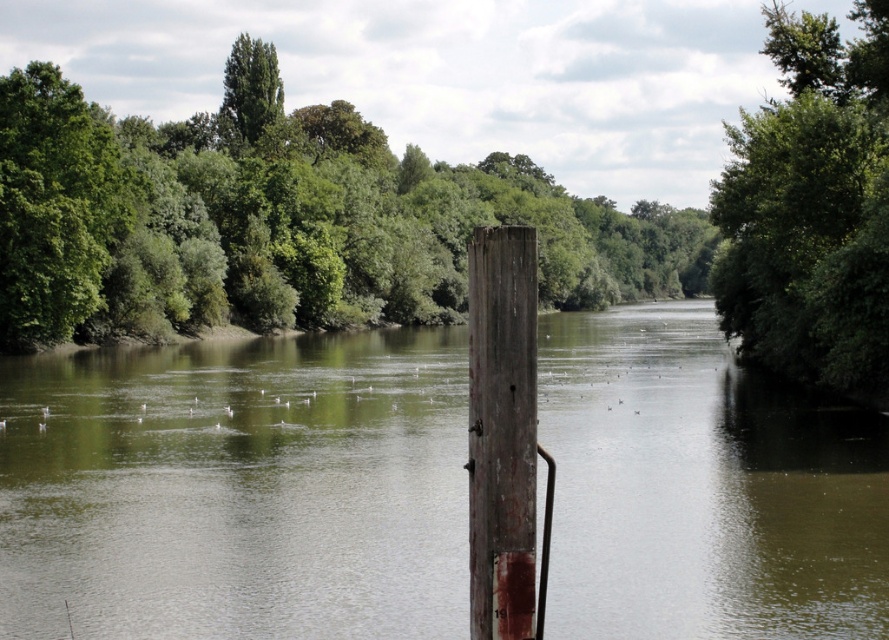
Is green leafy tree at upper right thinner than weathered wood post at center?

No.

Locate an element on the screen. The width and height of the screenshot is (889, 640). green leafy tree at upper right is located at coordinates (811, 209).

Who is more distant from viewer, [751,292] or [502,518]?

Positioned behind is point [751,292].

The image size is (889, 640). What are the coordinates of `green leafy tree at upper right` in the screenshot? It's located at (811, 209).

Does point (742, 570) come closer to viewer compared to point (859, 173)?

Yes, point (742, 570) is closer to viewer.

Consider the image. Is greenish-brown water at center smaller than green leafy tree at upper right?

Indeed, greenish-brown water at center has a smaller size compared to green leafy tree at upper right.

Which is behind, point (729, 518) or point (869, 374)?

Positioned behind is point (869, 374).

The width and height of the screenshot is (889, 640). Find the location of `greenish-brown water at center`. greenish-brown water at center is located at coordinates (237, 490).

Between greenish-brown water at center and weathered wood post at center, which one has more height?

greenish-brown water at center

Can you confirm if greenish-brown water at center is positioned below weathered wood post at center?

No.

Which is in front, point (833, 609) or point (495, 589)?

Positioned in front is point (495, 589).

At what (x,y) coordinates should I click in order to perform the action: click on greenish-brown water at center. Please return your answer as a coordinate pair (x, y). Looking at the image, I should click on (237, 490).